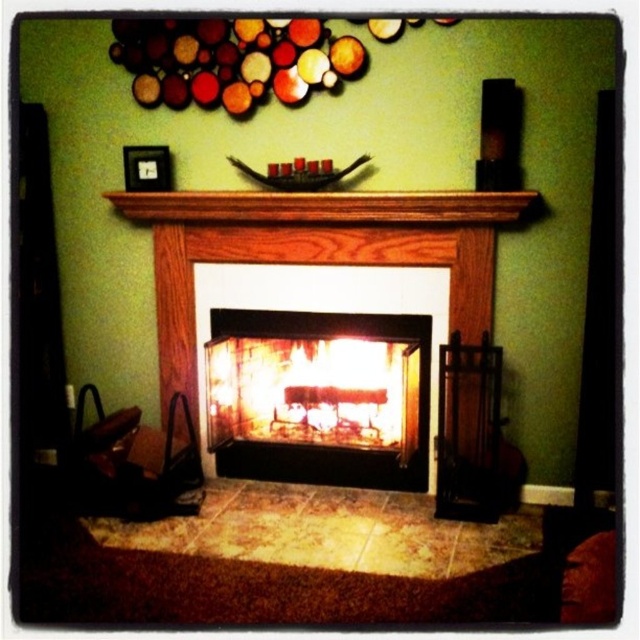
Question: Among these objects, which one is farthest from the camera?

Choices:
 (A) wooden mantel at center
 (B) flaming wood fire at center
 (C) wooden fireplace at center

Answer: (B)

Question: Which object is positioned closest to the wooden mantel at center?

Choices:
 (A) wooden fireplace at center
 (B) flaming wood fire at center

Answer: (A)

Question: Among these points, which one is nearest to the camera?

Choices:
 (A) (436, 204)
 (B) (451, 253)
 (C) (300, 417)

Answer: (A)

Question: Is wooden fireplace at center to the right of wooden mantel at center from the viewer's perspective?

Choices:
 (A) no
 (B) yes

Answer: (B)

Question: Does wooden fireplace at center have a smaller size compared to flaming wood fire at center?

Choices:
 (A) yes
 (B) no

Answer: (B)

Question: From the image, what is the correct spatial relationship of flaming wood fire at center in relation to wooden mantel at center?

Choices:
 (A) right
 (B) left

Answer: (A)